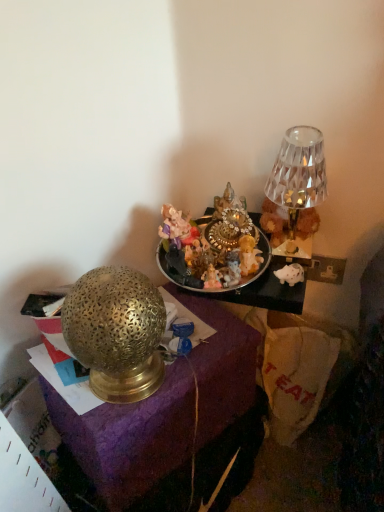
Question: In the image, is gold textured lamp at left on the left side or the right side of crystal glass lamp at upper right?

Choices:
 (A) right
 (B) left

Answer: (B)

Question: Based on their sizes in the image, would you say gold textured lamp at left is bigger or smaller than crystal glass lamp at upper right?

Choices:
 (A) big
 (B) small

Answer: (A)

Question: Based on their relative distances, which object is farther from the crystal glass lamp at upper right?

Choices:
 (A) shiny metallic tray at center
 (B) gold textured lamp at left

Answer: (B)

Question: Estimate the real-world distances between objects in this image. Which object is closer to the crystal glass lamp at upper right?

Choices:
 (A) gold textured lamp at left
 (B) shiny metallic tray at center

Answer: (B)